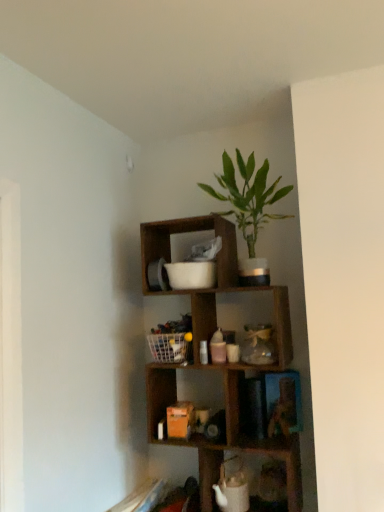
Question: Is white mesh basket at center to the left or to the right of wooden cube at upper center in the image?

Choices:
 (A) left
 (B) right

Answer: (A)

Question: Is white mesh basket at center bigger or smaller than wooden cube at upper center?

Choices:
 (A) big
 (B) small

Answer: (B)

Question: Which is nearer to the wooden cube at upper center?

Choices:
 (A) white mesh basket at center
 (B) green leafy plant in pot at upper center

Answer: (A)

Question: Which object is the closest to the wooden cube at upper center?

Choices:
 (A) white mesh basket at center
 (B) green leafy plant in pot at upper center

Answer: (A)